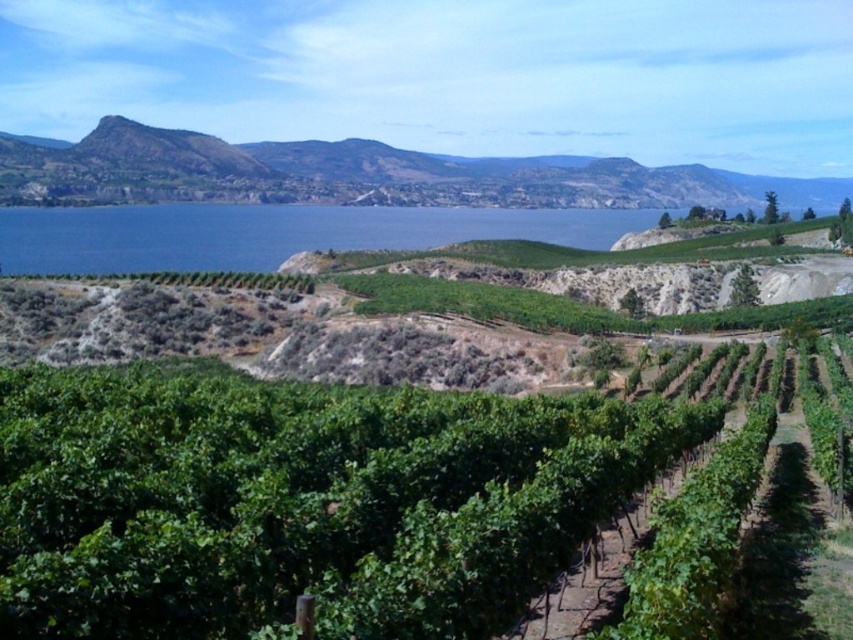
Does green leafy vines at center have a lesser height compared to blue water at center?

Indeed, green leafy vines at center has a lesser height compared to blue water at center.

Can you confirm if green leafy vines at center is bigger than blue water at center?

No.

Is point (374, 637) positioned behind point (36, 246)?

That is False.

This screenshot has height=640, width=853. Find the location of `green leafy vines at center`. green leafy vines at center is located at coordinates (302, 500).

How far apart are green leafy vines at center and green leafy hillside at upper center?

green leafy vines at center is 563.42 meters from green leafy hillside at upper center.

Does green leafy vines at center have a smaller size compared to green leafy hillside at upper center?

Yes, green leafy vines at center is smaller than green leafy hillside at upper center.

You are a GUI agent. You are given a task and a screenshot of the screen. Output one action in this format:
    pyautogui.click(x=<x>, y=<y>)
    Task: Click on the green leafy vines at center
    The image size is (853, 640).
    Given the screenshot: What is the action you would take?
    pyautogui.click(x=302, y=500)

Which is more to the right, green leafy hillside at upper center or blue water at center?

green leafy hillside at upper center is more to the right.

Is green leafy hillside at upper center to the right of blue water at center from the viewer's perspective?

Indeed, green leafy hillside at upper center is positioned on the right side of blue water at center.

Does point (341, 182) come closer to viewer compared to point (605, 237)?

No, (341, 182) is behind (605, 237).

Locate an element on the screen. This screenshot has height=640, width=853. green leafy hillside at upper center is located at coordinates (357, 173).